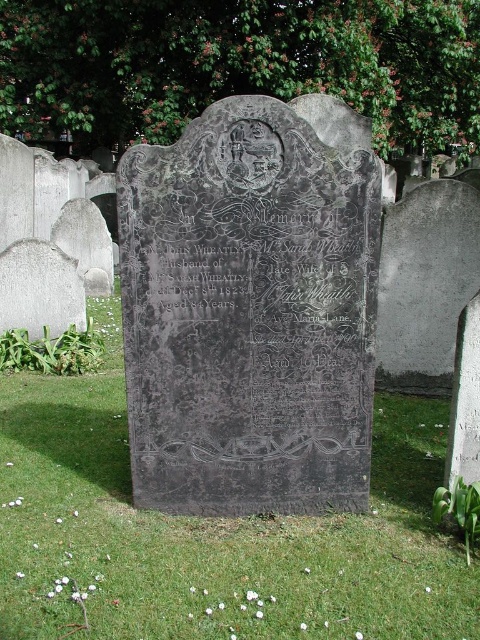
Question: From the image, what is the correct spatial relationship of black stone gravestone at center in relation to green grass at center?

Choices:
 (A) below
 (B) above

Answer: (B)

Question: Can you confirm if black stone gravestone at center is positioned above green grass at center?

Choices:
 (A) no
 (B) yes

Answer: (B)

Question: Is black stone gravestone at center positioned in front of green grass at center?

Choices:
 (A) yes
 (B) no

Answer: (B)

Question: Which object is farther from the camera taking this photo?

Choices:
 (A) black stone gravestone at center
 (B) green grass at center

Answer: (A)